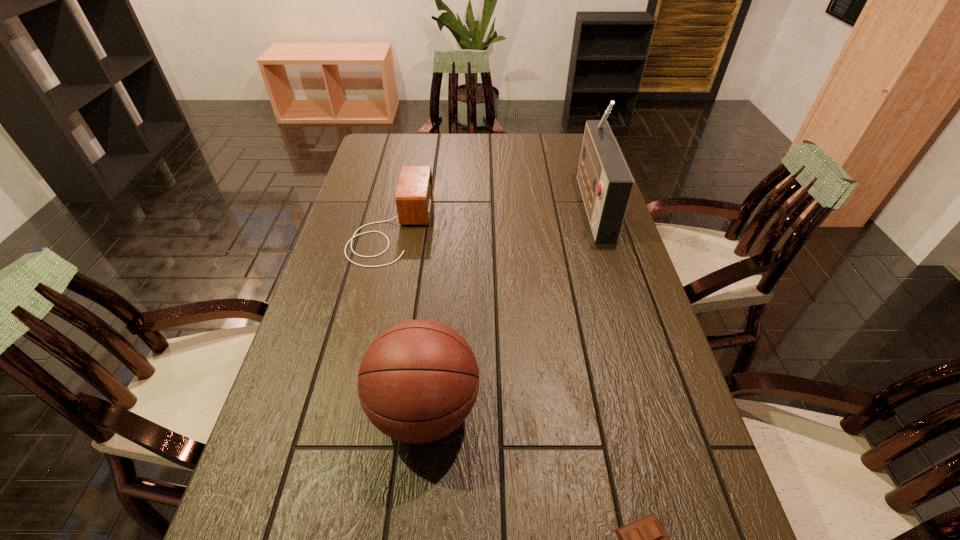
At what (x,y) coordinates should I click in order to perform the action: click on the taller radio receiver. Please return your answer as a coordinate pair (x, y). Looking at the image, I should click on (605, 182).

Find the location of a particular element. This screenshot has height=540, width=960. the right radio receiver is located at coordinates pos(605,182).

Where is `the second nearest object`? the second nearest object is located at coordinates (418, 381).

You are a GUI agent. You are given a task and a screenshot of the screen. Output one action in this format:
    pyautogui.click(x=<x>, y=<y>)
    Task: Click on the basketball
    
    Given the screenshot: What is the action you would take?
    pyautogui.click(x=418, y=381)

At what (x,y) coordinates should I click in order to perform the action: click on the second shortest object. Please return your answer as a coordinate pair (x, y). The image size is (960, 540). Looking at the image, I should click on (414, 194).

What are the coordinates of `the shorter radio receiver` in the screenshot? It's located at (414, 194).

Locate an element on the screen. The height and width of the screenshot is (540, 960). free space located on the front panel of the tallest object is located at coordinates (500, 204).

You are a GUI agent. You are given a task and a screenshot of the screen. Output one action in this format:
    pyautogui.click(x=<x>, y=<y>)
    Task: Click on the blank space located on the front panel of the tallest object
    
    Given the screenshot: What is the action you would take?
    pyautogui.click(x=473, y=204)

Where is `vacant area situated on the front panel of the tallest object`? Image resolution: width=960 pixels, height=540 pixels. vacant area situated on the front panel of the tallest object is located at coordinates (547, 204).

You are a GUI agent. You are given a task and a screenshot of the screen. Output one action in this format:
    pyautogui.click(x=<x>, y=<y>)
    Task: Click on the vacant region located 0.060m on the left of the third farthest object
    This screenshot has height=540, width=960.
    Given the screenshot: What is the action you would take?
    pyautogui.click(x=342, y=410)